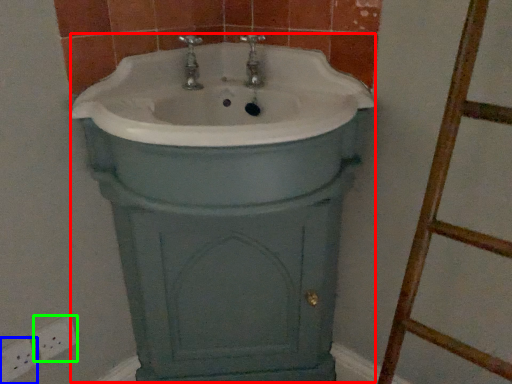
Question: Which is nearer to the porcelain (highlighted by a red box)? electric outlet (highlighted by a blue box) or electric outlet (highlighted by a green box).

Choices:
 (A) electric outlet
 (B) electric outlet

Answer: (B)